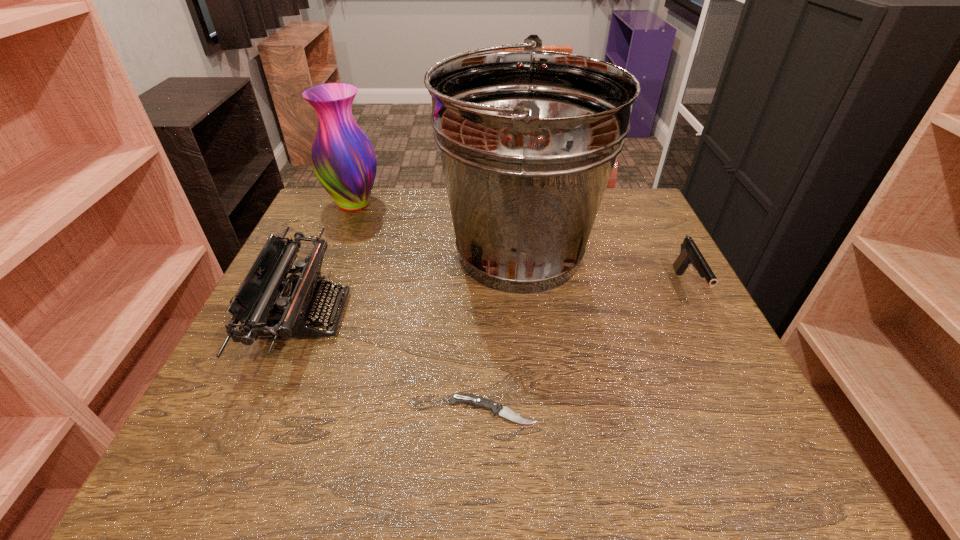
At what (x,y) coordinates should I click in order to perform the action: click on blank space located 0.140m at the muzzle of the second shortest object. Please return your answer as a coordinate pair (x, y). The height and width of the screenshot is (540, 960). Looking at the image, I should click on (730, 368).

I want to click on vacant region located 0.220m on the right of the pocketknife, so click(x=668, y=411).

You are a GUI agent. You are given a task and a screenshot of the screen. Output one action in this format:
    pyautogui.click(x=<x>, y=<y>)
    Task: Click on the bucket that is at the far edge
    
    Given the screenshot: What is the action you would take?
    pyautogui.click(x=528, y=139)

At what (x,y) coordinates should I click in order to perform the action: click on vase positioned at the far edge. Please return your answer as a coordinate pair (x, y). Looking at the image, I should click on (343, 159).

Where is `object at the near edge`? object at the near edge is located at coordinates (477, 401).

Identify the location of vase that is at the left edge. (343, 159).

Where is `typewriter at the left edge`? The image size is (960, 540). typewriter at the left edge is located at coordinates (300, 297).

Locate an element on the screen. object located at the right edge is located at coordinates (690, 255).

Find the location of `object that is positioned at the far left corner`. object that is positioned at the far left corner is located at coordinates (343, 159).

The image size is (960, 540). In the image, there is a desktop. What are the coordinates of `vacant space at the far edge` in the screenshot? It's located at coord(383,221).